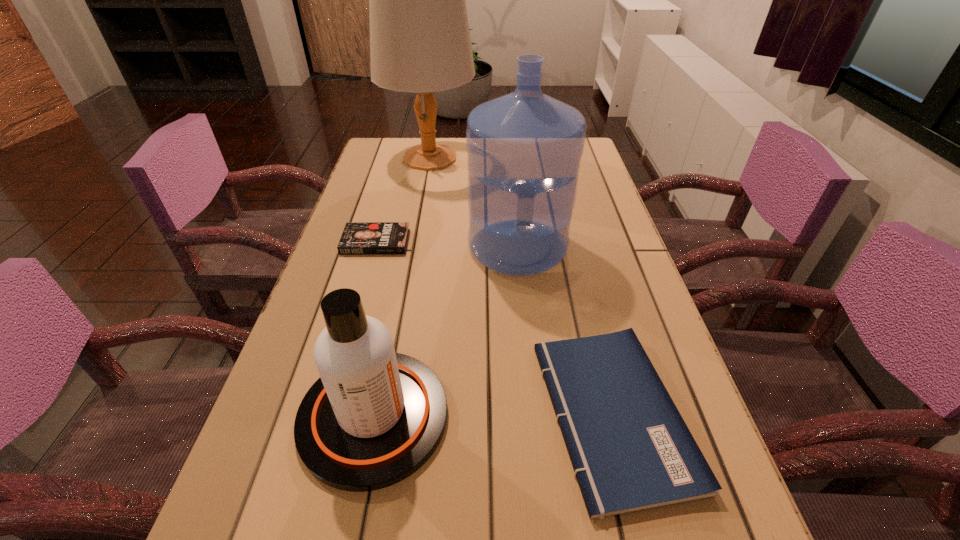
Find the location of `free space between the farthest object and the second shortest object`. free space between the farthest object and the second shortest object is located at coordinates pyautogui.click(x=521, y=286).

The image size is (960, 540). In order to click on blank region between the second shortest object and the table lamp in this screenshot , I will do `click(521, 286)`.

Locate an element on the screen. empty space that is in between the water jug and the book is located at coordinates (446, 244).

Image resolution: width=960 pixels, height=540 pixels. In order to click on empty space that is in between the water jug and the cleansing agent in this screenshot , I will do `click(445, 331)`.

At what (x,y) coordinates should I click in order to perform the action: click on vacant space that is in between the cleansing agent and the farthest object. Please return your answer as a coordinate pair (x, y). The image size is (960, 540). Looking at the image, I should click on (401, 287).

Where is `unoccupied area between the farthest object and the paperback book`? The width and height of the screenshot is (960, 540). unoccupied area between the farthest object and the paperback book is located at coordinates (521, 286).

Locate which object is the closest to the third tallest object. Please provide its 2D coordinates. Your answer should be formatted as a tuple, i.e. [(x, y)], where the tuple contains the x and y coordinates of a point satisfying the conditions above.

[(630, 448)]

This screenshot has width=960, height=540. Identify the location of object that stands as the second closest to the cleansing agent. [524, 149].

Identify the location of free space that satisfies the following two spatial constraints: 1. on the back side of the table lamp; 2. on the right side of the cleansing agent. (424, 158).

Identify the location of vacant space that satisfies the following two spatial constraints: 1. on the front side of the third shortest object; 2. on the left side of the shortest object. This screenshot has height=540, width=960. (325, 416).